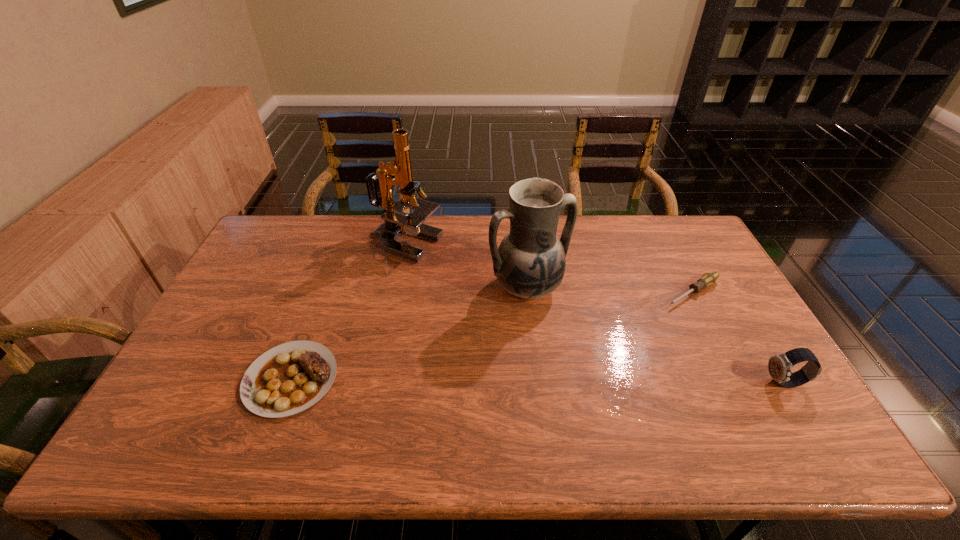
The image size is (960, 540). I want to click on vacant space located 0.310m on the front-facing side of the pitcher, so click(609, 392).

Locate an element on the screen. free spot located 0.100m on the front-facing side of the pitcher is located at coordinates (564, 333).

Image resolution: width=960 pixels, height=540 pixels. I want to click on free space located on the front-facing side of the pitcher, so click(612, 395).

Where is `vacant space located 0.230m at the eyepiece of the farthest object`? vacant space located 0.230m at the eyepiece of the farthest object is located at coordinates (469, 294).

What are the coordinates of `free space located at the eyepiece of the farthest object` in the screenshot? It's located at (468, 292).

Locate an element on the screen. vacant space situated 0.120m at the eyepiece of the farthest object is located at coordinates (448, 276).

The image size is (960, 540). I want to click on vacant space located 0.060m at the tip of the screwdriver, so click(659, 310).

I want to click on free space located at the tip of the screwdriver, so click(659, 310).

You are a GUI agent. You are given a task and a screenshot of the screen. Output one action in this format:
    pyautogui.click(x=<x>, y=<y>)
    Task: Click on the free region located at the tip of the screwdriver
    The width and height of the screenshot is (960, 540).
    Given the screenshot: What is the action you would take?
    pyautogui.click(x=656, y=312)

Where is `object that is at the far edge`? object that is at the far edge is located at coordinates (397, 223).